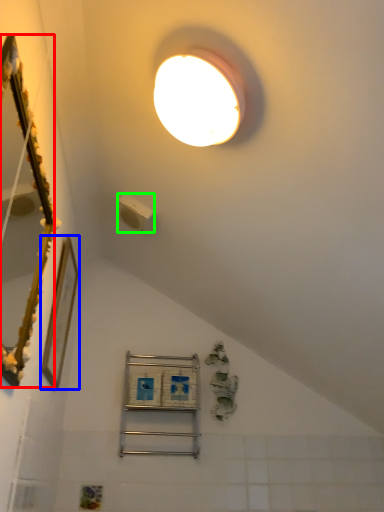
Question: Which is nearer to the mirror (highlighted by a red box)? picture frame (highlighted by a blue box) or light switch (highlighted by a green box).

Choices:
 (A) picture frame
 (B) light switch

Answer: (A)